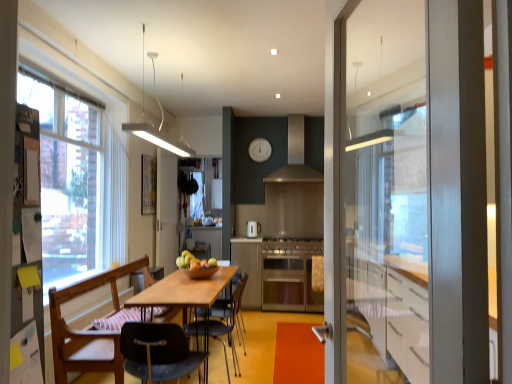
Where is `free area below metallic silver handle at center (from a real-world perspective)`? Image resolution: width=512 pixels, height=384 pixels. free area below metallic silver handle at center (from a real-world perspective) is located at coordinates (301, 352).